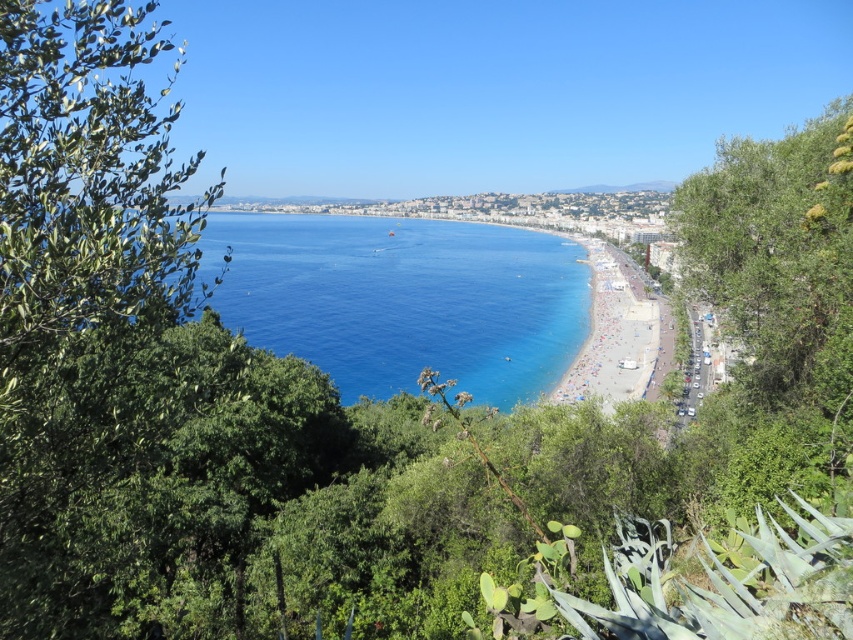
Question: Considering the relative positions of blue liquid water at center and light brown sand at center in the image provided, where is blue liquid water at center located with respect to light brown sand at center?

Choices:
 (A) below
 (B) above

Answer: (B)

Question: Which of the following is the farthest from the observer?

Choices:
 (A) (625, 336)
 (B) (471, 291)

Answer: (B)

Question: Is green leafy tree at left below light brown sand at center?

Choices:
 (A) yes
 (B) no

Answer: (A)

Question: Which point is closer to the camera taking this photo?

Choices:
 (A) (589, 392)
 (B) (299, 307)
 (C) (33, 273)

Answer: (C)

Question: Among these points, which one is nearest to the camera?

Choices:
 (A) (292, 324)
 (B) (624, 365)

Answer: (B)

Question: Does green leafy tree at left come behind light brown sand at center?

Choices:
 (A) no
 (B) yes

Answer: (A)